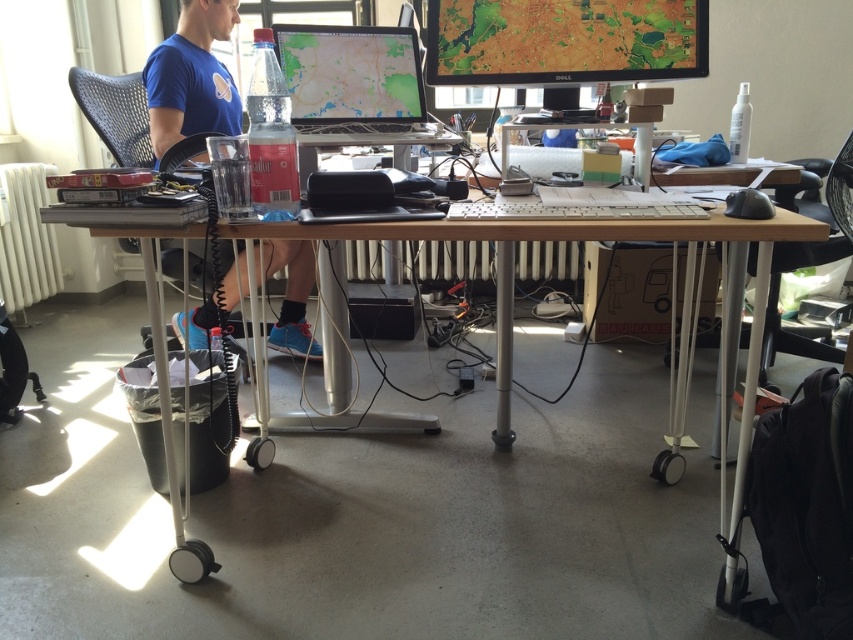
Consider the image. Which is more to the left, matte plastic monitor at upper center or black plastic chair at right?

matte plastic monitor at upper center is more to the left.

Locate an element on the screen. The image size is (853, 640). matte plastic monitor at upper center is located at coordinates (564, 40).

What are the coordinates of `matte plastic monitor at upper center` in the screenshot? It's located at (564, 40).

Can you confirm if blue cotton shirt at upper left is bigger than black plastic chair at right?

No, blue cotton shirt at upper left is not bigger than black plastic chair at right.

Does blue cotton shirt at upper left come behind black plastic chair at right?

Yes, blue cotton shirt at upper left is behind black plastic chair at right.

Where is `blue cotton shirt at upper left`? The width and height of the screenshot is (853, 640). blue cotton shirt at upper left is located at coordinates pyautogui.click(x=192, y=76).

Where is `blue cotton shirt at upper left`? The height and width of the screenshot is (640, 853). blue cotton shirt at upper left is located at coordinates (192, 76).

Can you confirm if matte plastic monitor at upper center is taller than matte plastic monitor at center?

Incorrect, matte plastic monitor at upper center's height is not larger of matte plastic monitor at center's.

Can you confirm if matte plastic monitor at upper center is positioned to the left of matte plastic monitor at center?

In fact, matte plastic monitor at upper center is to the right of matte plastic monitor at center.

Is point (679, 16) more distant than point (370, 60)?

That is False.

The height and width of the screenshot is (640, 853). In order to click on matte plastic monitor at upper center in this screenshot , I will do `click(564, 40)`.